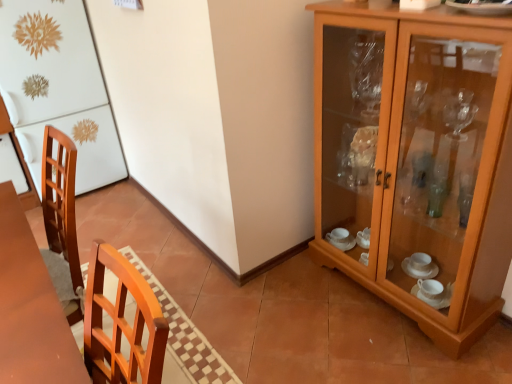
Question: Can you confirm if wooden cabinet at right is shorter than white glossy refrigerator at left?

Choices:
 (A) yes
 (B) no

Answer: (A)

Question: Is white glossy refrigerator at left located within wooden cabinet at right?

Choices:
 (A) no
 (B) yes

Answer: (A)

Question: Could you tell me if wooden cabinet at right is turned towards white glossy refrigerator at left?

Choices:
 (A) no
 (B) yes

Answer: (A)

Question: From a real-world perspective, is wooden cabinet at right beneath white glossy refrigerator at left?

Choices:
 (A) yes
 (B) no

Answer: (A)

Question: Can you confirm if wooden cabinet at right is smaller than white glossy refrigerator at left?

Choices:
 (A) yes
 (B) no

Answer: (A)

Question: Is wooden cabinet at right to the right of white glossy refrigerator at left from the viewer's perspective?

Choices:
 (A) no
 (B) yes

Answer: (B)

Question: Does white glossy refrigerator at left turn towards wooden cabinet at right?

Choices:
 (A) no
 (B) yes

Answer: (A)

Question: From a real-world perspective, does white glossy refrigerator at left stand above wooden cabinet at right?

Choices:
 (A) yes
 (B) no

Answer: (A)

Question: From a real-world perspective, is white glossy refrigerator at left located beneath wooden cabinet at right?

Choices:
 (A) no
 (B) yes

Answer: (A)

Question: Is white glossy refrigerator at left far from wooden cabinet at right?

Choices:
 (A) no
 (B) yes

Answer: (B)

Question: Is white glossy refrigerator at left located outside wooden cabinet at right?

Choices:
 (A) no
 (B) yes

Answer: (B)

Question: Does white glossy refrigerator at left have a smaller size compared to wooden cabinet at right?

Choices:
 (A) yes
 (B) no

Answer: (B)

Question: Visually, is wooden cabinet at right positioned to the left or to the right of white glossy refrigerator at left?

Choices:
 (A) left
 (B) right

Answer: (B)